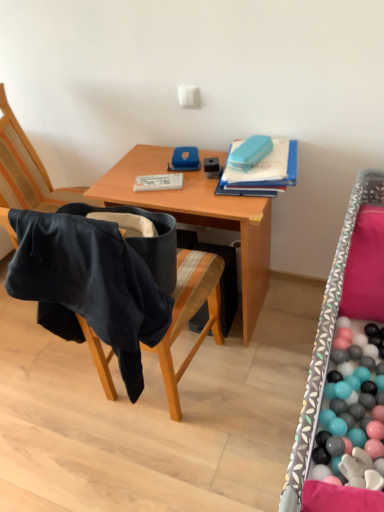
Find the location of `blue matte folder at upper right`. blue matte folder at upper right is located at coordinates (263, 180).

Describe the element at coordinates (326, 340) in the screenshot. I see `patterned fabric bed frame at right` at that location.

Describe the element at coordinates (199, 214) in the screenshot. This screenshot has height=512, width=384. I see `wooden desk at center` at that location.

Where is `black fabric chair at left`? The width and height of the screenshot is (384, 512). black fabric chair at left is located at coordinates tap(190, 314).

Does patterned fabric bed frame at right appear on the left side of black fabric chair at left?

Incorrect, patterned fabric bed frame at right is not on the left side of black fabric chair at left.

Who is smaller, patterned fabric bed frame at right or black fabric chair at left?

With smaller size is black fabric chair at left.

From a real-world perspective, does patterned fabric bed frame at right sit lower than black fabric chair at left?

Indeed, from a real-world perspective, patterned fabric bed frame at right is positioned beneath black fabric chair at left.

From the image's perspective, is wooden desk at center located beneath patterned fabric bed frame at right?

No, from the image's perspective, wooden desk at center is not below patterned fabric bed frame at right.

Can you confirm if wooden desk at center is taller than patterned fabric bed frame at right?

No, wooden desk at center is not taller than patterned fabric bed frame at right.

Where is `bed frame in front of the wooden desk at center`? This screenshot has width=384, height=512. bed frame in front of the wooden desk at center is located at coordinates [326, 340].

Which of these two, wooden desk at center or patterned fabric bed frame at right, is wider?

Wider between the two is wooden desk at center.

Is blue matte folder at upper right taller than wooden desk at center?

No, blue matte folder at upper right is not taller than wooden desk at center.

Is the surface of blue matte folder at upper right in direct contact with wooden desk at center?

blue matte folder at upper right and wooden desk at center are not in contact.

Between blue matte folder at upper right and wooden desk at center, which one has smaller width?

With smaller width is blue matte folder at upper right.

From the image's perspective, is blue matte folder at upper right under wooden desk at center?

No.

Considering the points (181, 329) and (292, 178), which point is behind, point (181, 329) or point (292, 178)?

The point (292, 178) is behind.

In the scene shown: From a real-world perspective, is black fabric chair at left beneath blue matte folder at upper right?

Yes.

Is black fabric chair at left further to the viewer compared to blue matte folder at upper right?

No.

Who is taller, black fabric chair at left or blue matte folder at upper right?

black fabric chair at left is taller.

Based on the photo, is blue matte folder at upper right at the back of patterned fabric bed frame at right?

patterned fabric bed frame at right is not turned away from blue matte folder at upper right.

Can you confirm if patterned fabric bed frame at right is positioned to the right of blue matte folder at upper right?

Indeed, patterned fabric bed frame at right is positioned on the right side of blue matte folder at upper right.

Is patterned fabric bed frame at right smaller than blue matte folder at upper right?

No.

From the image's perspective, which object appears higher, patterned fabric bed frame at right or blue matte folder at upper right?

blue matte folder at upper right, from the image's perspective.

Find the location of `book on the left of patterned fabric bed frame at right`. book on the left of patterned fabric bed frame at right is located at coordinates (263, 180).

Could you tell me if blue matte folder at upper right is turned towards patterned fabric bed frame at right?

No.

In the scene shown: Is patterned fabric bed frame at right inside blue matte folder at upper right?

Actually, patterned fabric bed frame at right is outside blue matte folder at upper right.

Which object is wider, blue matte folder at upper right or patterned fabric bed frame at right?

Wider between the two is blue matte folder at upper right.

From a real-world perspective, is patterned fabric bed frame at right above or below wooden desk at center?

patterned fabric bed frame at right is situated higher than wooden desk at center in the real world.

Considering the positions of objects patterned fabric bed frame at right and wooden desk at center in the image provided, who is more to the right, patterned fabric bed frame at right or wooden desk at center?

patterned fabric bed frame at right is more to the right.

Based on their sizes in the image, would you say patterned fabric bed frame at right is bigger or smaller than wooden desk at center?

Considering their sizes, patterned fabric bed frame at right takes up more space than wooden desk at center.

The height and width of the screenshot is (512, 384). What are the coordinates of `desk above the patterned fabric bed frame at right (from the image's perspective)` in the screenshot? It's located at (199, 214).

At what (x,y) coordinates should I click in order to perform the action: click on chair that is on the left side of patterned fabric bed frame at right. Please return your answer as a coordinate pair (x, y). Looking at the image, I should click on pos(190,314).

Image resolution: width=384 pixels, height=512 pixels. Identify the location of desk that appears below the patterned fabric bed frame at right (from a real-world perspective). (199, 214).

Estimate the real-world distances between objects in this image. Which object is closer to patterned fabric bed frame at right, wooden desk at center or black fabric chair at left?

wooden desk at center is positioned closer to the anchor patterned fabric bed frame at right.

Consider the image. When comparing their distances from blue matte folder at upper right, does black fabric chair at left or patterned fabric bed frame at right seem closer?

black fabric chair at left is positioned closer to the anchor blue matte folder at upper right.

Considering their positions, is blue matte folder at upper right positioned closer to patterned fabric bed frame at right than black fabric chair at left?

Among the two, blue matte folder at upper right is located nearer to patterned fabric bed frame at right.

Based on their spatial positions, is wooden desk at center or patterned fabric bed frame at right closer to black fabric chair at left?

Among the two, wooden desk at center is located nearer to black fabric chair at left.

Consider the image. Based on their spatial positions, is patterned fabric bed frame at right or black fabric chair at left closer to wooden desk at center?

Based on the image, black fabric chair at left appears to be nearer to wooden desk at center.

Considering their positions, is patterned fabric bed frame at right positioned closer to black fabric chair at left than wooden desk at center?

wooden desk at center.

Looking at the image, which one is located further to wooden desk at center, blue matte folder at upper right or black fabric chair at left?

Among the two, black fabric chair at left is located further to wooden desk at center.

Consider the image. From the image, which object appears to be farther from black fabric chair at left, blue matte folder at upper right or patterned fabric bed frame at right?

Among the two, patterned fabric bed frame at right is located further to black fabric chair at left.

Where is `chair between patterned fabric bed frame at right and blue matte folder at upper right in the front-back direction`? This screenshot has height=512, width=384. chair between patterned fabric bed frame at right and blue matte folder at upper right in the front-back direction is located at coordinates (190, 314).

Where is `desk between patterned fabric bed frame at right and blue matte folder at upper right from front to back`? desk between patterned fabric bed frame at right and blue matte folder at upper right from front to back is located at coordinates (199, 214).

Locate an element on the screen. The width and height of the screenshot is (384, 512). desk between black fabric chair at left and blue matte folder at upper right in the front-back direction is located at coordinates [x=199, y=214].

What are the coordinates of `chair between patterned fabric bed frame at right and wooden desk at center in the front-back direction` in the screenshot? It's located at (190, 314).